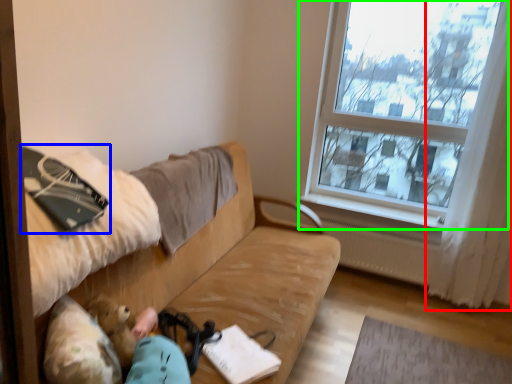
Question: Based on their relative distances, which object is nearer to curtain (highlighted by a red box)? Choose from notebook (highlighted by a blue box) and window (highlighted by a green box).

Choices:
 (A) notebook
 (B) window

Answer: (B)